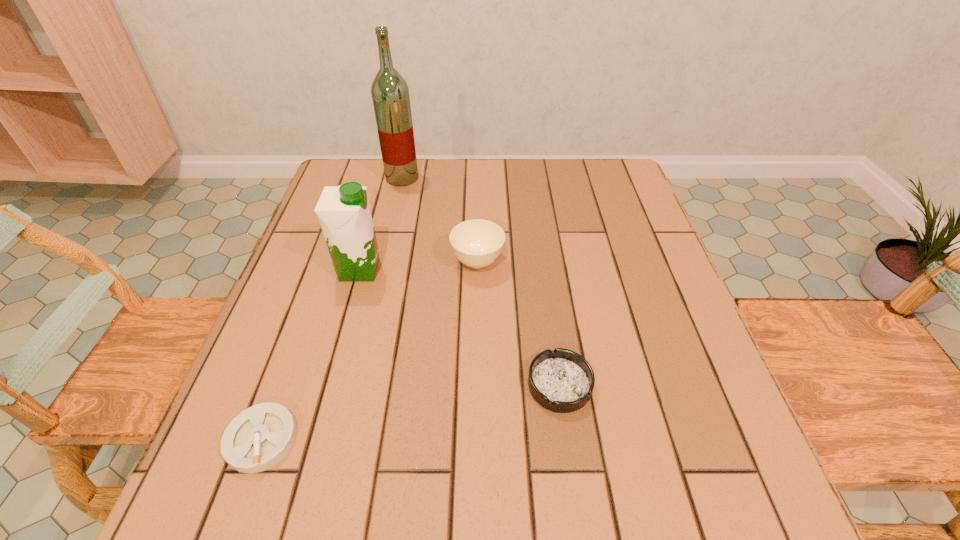
You are a GUI agent. You are given a task and a screenshot of the screen. Output one action in this format:
    pyautogui.click(x=<x>, y=<y>)
    Task: Click on the vacant space at the near edge
    The width and height of the screenshot is (960, 540).
    Given the screenshot: What is the action you would take?
    pyautogui.click(x=465, y=478)

Where is `free point at the left edge`? This screenshot has height=540, width=960. free point at the left edge is located at coordinates (283, 289).

The image size is (960, 540). In the image, there is a desktop. Identify the location of vacant space at the right edge. (637, 245).

In the image, there is a desktop. Where is `vacant area at the near left corner`? vacant area at the near left corner is located at coordinates (272, 474).

Locate an element on the screen. The image size is (960, 540). free space at the far right corner is located at coordinates (625, 183).

At what (x,y) coordinates should I click in order to perform the action: click on free space at the near right corner of the desktop. Please return your answer as a coordinate pair (x, y). Looking at the image, I should click on (759, 491).

What are the coordinates of `free spot between the soya milk and the sugar bowl` in the screenshot? It's located at (419, 266).

What are the coordinates of `free space between the rightmost object and the tallest object` in the screenshot? It's located at (481, 281).

Where is `free space between the liquor and the left ashtray`? Image resolution: width=960 pixels, height=540 pixels. free space between the liquor and the left ashtray is located at coordinates [x=332, y=309].

You are a GUI agent. You are given a task and a screenshot of the screen. Output one action in this format:
    pyautogui.click(x=<x>, y=<y>)
    Task: Click on the unoccupied area between the left ashtray and the soya milk
    The height and width of the screenshot is (540, 960).
    Given the screenshot: What is the action you would take?
    pyautogui.click(x=311, y=355)